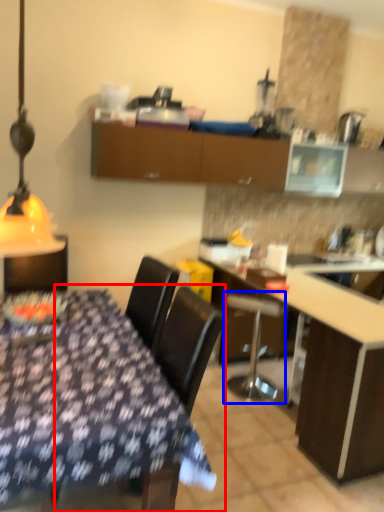
Question: Which of the following is the closest to the observer, chair (highlighted by a red box) or bar stool (highlighted by a blue box)?

Choices:
 (A) chair
 (B) bar stool

Answer: (A)